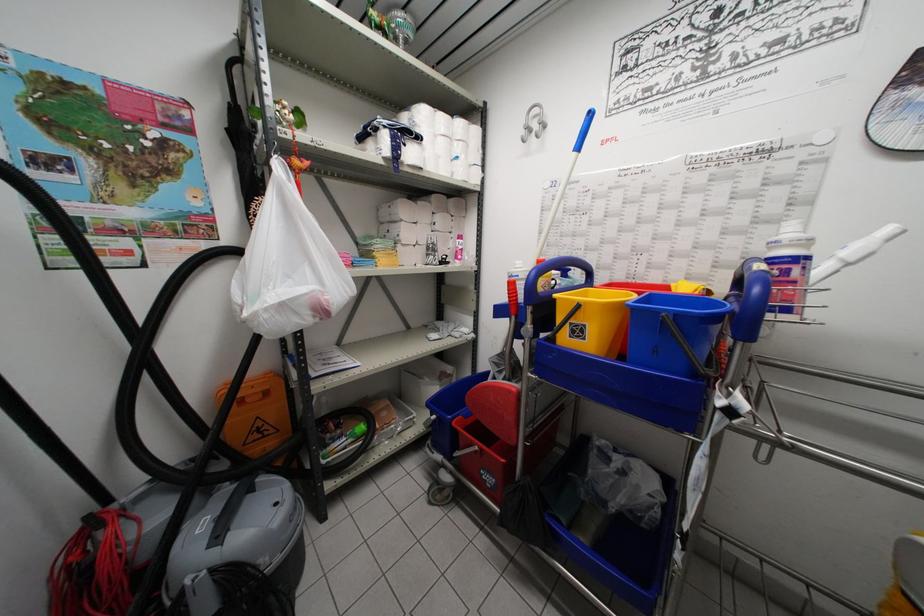
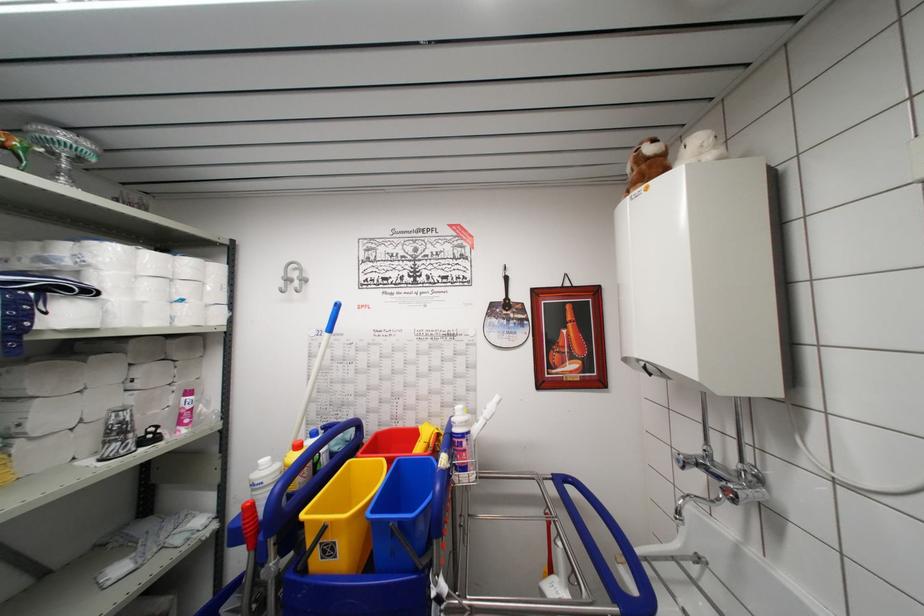
Where in the second image is the point corresponding to (x=443, y=161) from the first image?

(149, 307)